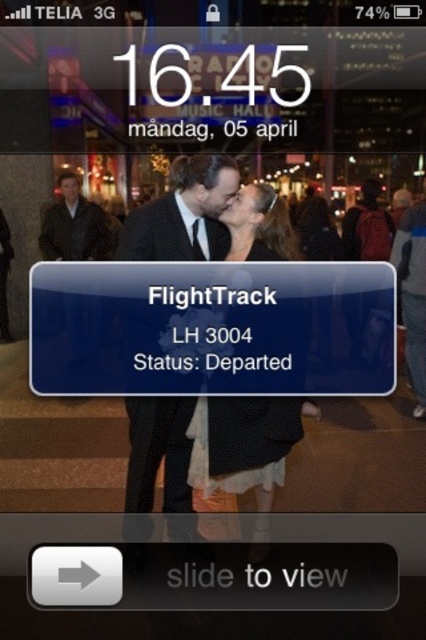
Between point (201, 180) and point (106, 225), which one is positioned in front?

Point (201, 180) is in front.

Between black suit at center and leather jacket at left, which one has less height?

leather jacket at left

What do you see at coordinates (184, 212) in the screenshot? I see `black suit at center` at bounding box center [184, 212].

In order to click on black suit at center in this screenshot , I will do `click(184, 212)`.

Is blue fabric jacket at right below black silk suit at center?

Yes.

Is blue fabric jacket at right to the right of black silk suit at center from the viewer's perspective?

Correct, you'll find blue fabric jacket at right to the right of black silk suit at center.

Image resolution: width=426 pixels, height=640 pixels. I want to click on blue fabric jacket at right, so click(412, 294).

Between point (422, 275) and point (83, 196), which one is positioned in front?

Positioned in front is point (422, 275).

Identify the location of blue fabric jacket at right. (412, 294).